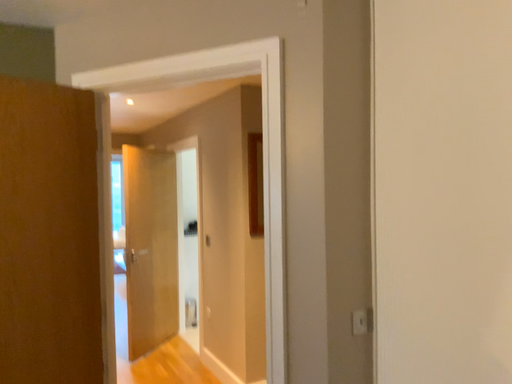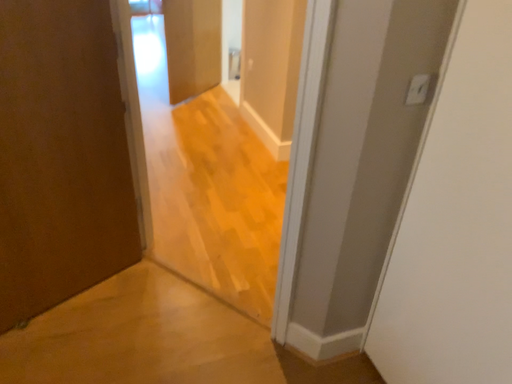
Question: Which way did the camera rotate in the video?

Choices:
 (A) rotated downward
 (B) rotated upward

Answer: (A)